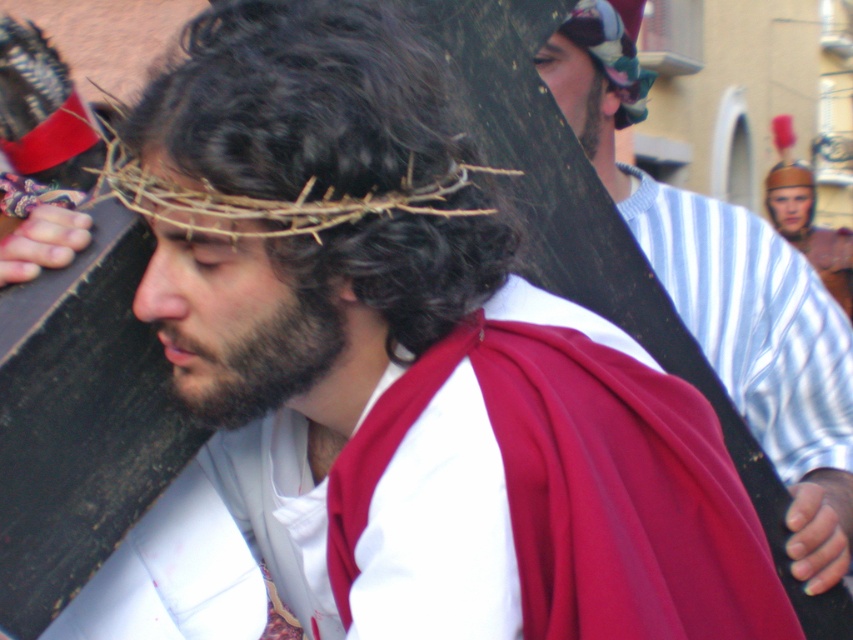
Question: Estimate the real-world distances between objects in this image. Which object is closer to the brown leather helmet at upper center?

Choices:
 (A) brown woven crown at center
 (B) dark brown beard at upper center
 (C) brownwoollybeard at center

Answer: (B)

Question: Is brown woven crown at center smaller than multicolored fabric headband at upper center?

Choices:
 (A) yes
 (B) no

Answer: (B)

Question: Considering the real-world distances, which object is closest to the brown leather helmet at upper center?

Choices:
 (A) smooth brown wooden cross at center
 (B) dark brown beard at upper center
 (C) brown woven crown at center
 (D) multicolored fabric headband at upper center

Answer: (A)

Question: Which object appears farthest from the camera in this image?

Choices:
 (A) brownwoollybeard at center
 (B) brown leather helmet at upper center

Answer: (B)

Question: Is smooth brown wooden cross at center smaller than brownwoollybeard at center?

Choices:
 (A) no
 (B) yes

Answer: (A)

Question: Can you confirm if brownwoollybeard at center is positioned above multicolored fabric headband at upper center?

Choices:
 (A) no
 (B) yes

Answer: (A)